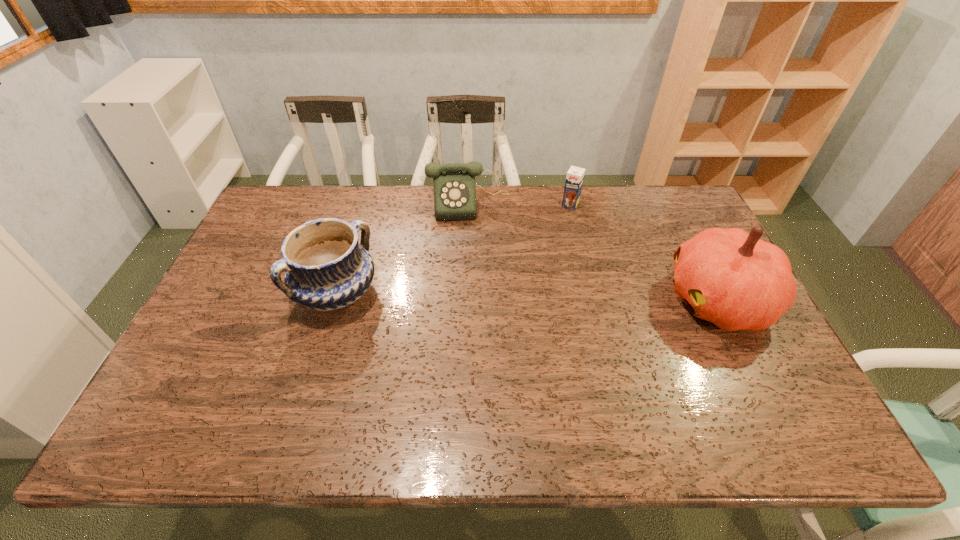
You are a GUI agent. You are given a task and a screenshot of the screen. Output one action in this format:
    pyautogui.click(x=<x>, y=<y>)
    Task: Click on the leftmost object
    
    Given the screenshot: What is the action you would take?
    pyautogui.click(x=326, y=268)

You are a GUI agent. You are given a task and a screenshot of the screen. Output one action in this format:
    pyautogui.click(x=<x>, y=<y>)
    Task: Click on the pottery
    The width and height of the screenshot is (960, 540).
    Given the screenshot: What is the action you would take?
    pyautogui.click(x=326, y=268)

Identify the location of pumpkin. The width and height of the screenshot is (960, 540). (729, 277).

Find the location of `the rightmost object`. the rightmost object is located at coordinates (729, 277).

Where is `the second object from left to right`? The image size is (960, 540). the second object from left to right is located at coordinates (454, 183).

Identify the location of the second object from right to left. The image size is (960, 540). (574, 180).

In order to click on vacant region located 0.160m on the right of the pottery in this screenshot , I will do `click(436, 294)`.

You are a GUI agent. You are given a task and a screenshot of the screen. Output one action in this format:
    pyautogui.click(x=<x>, y=<y>)
    Task: Click on the free spot located on the front-facing side of the pumpkin
    
    Given the screenshot: What is the action you would take?
    pyautogui.click(x=557, y=300)

Where is `blank space located on the front-facing side of the pumpkin`? Image resolution: width=960 pixels, height=540 pixels. blank space located on the front-facing side of the pumpkin is located at coordinates (571, 300).

This screenshot has width=960, height=540. I want to click on free location located on the front-facing side of the pumpkin, so click(582, 300).